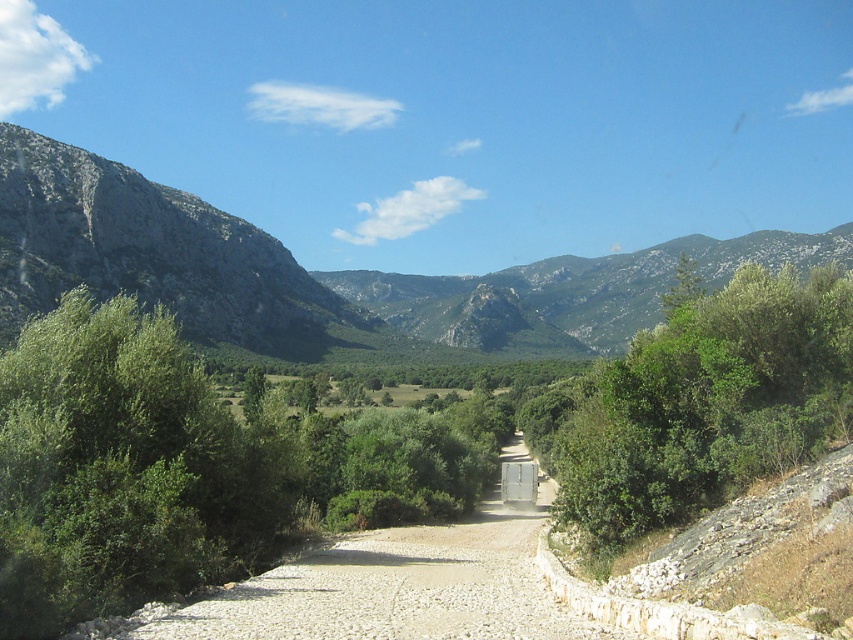
Question: Which of these objects is positioned closest to the green leafy bush at right?

Choices:
 (A) gray rocky mountain at left
 (B) green rocky mountain at left

Answer: (A)

Question: Which object is closer to the camera taking this photo?

Choices:
 (A) green leafy bush at right
 (B) gray rocky mountain at left
 (C) green rocky mountain at left

Answer: (A)

Question: Does green leafy bush at right appear under gray rocky mountain at left?

Choices:
 (A) yes
 (B) no

Answer: (A)

Question: Does green leafy bush at right appear on the left side of gray rocky mountain at left?

Choices:
 (A) yes
 (B) no

Answer: (B)

Question: Considering the real-world distances, which object is closest to the gray rocky mountain at left?

Choices:
 (A) green leafy bush at right
 (B) green rocky mountain at left

Answer: (B)

Question: From the image, what is the correct spatial relationship of green rocky mountain at left in relation to green leafy bush at right?

Choices:
 (A) below
 (B) above

Answer: (B)